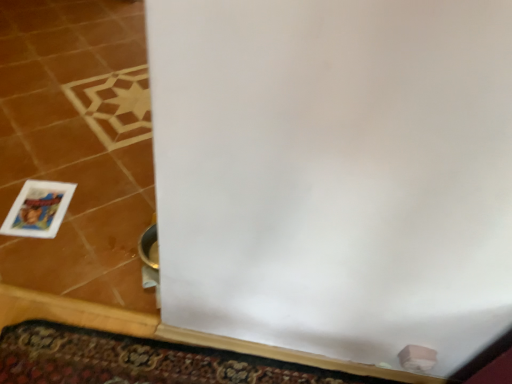
Question: Is carpeted doormat at lower center looking in the opposite direction of matte plastic picture frame at lower left?

Choices:
 (A) yes
 (B) no

Answer: (B)

Question: Considering the relative positions of carpeted doormat at lower center and matte plastic picture frame at lower left in the image provided, is carpeted doormat at lower center in front of matte plastic picture frame at lower left?

Choices:
 (A) yes
 (B) no

Answer: (A)

Question: Does carpeted doormat at lower center have a greater width compared to matte plastic picture frame at lower left?

Choices:
 (A) no
 (B) yes

Answer: (A)

Question: From the image's perspective, is carpeted doormat at lower center on top of matte plastic picture frame at lower left?

Choices:
 (A) yes
 (B) no

Answer: (B)

Question: Is carpeted doormat at lower center far away from matte plastic picture frame at lower left?

Choices:
 (A) yes
 (B) no

Answer: (B)

Question: From the image's perspective, is carpeted doormat at lower center below matte plastic picture frame at lower left?

Choices:
 (A) yes
 (B) no

Answer: (A)

Question: Is matte plastic picture frame at lower left shorter than carpeted doormat at lower center?

Choices:
 (A) no
 (B) yes

Answer: (A)

Question: From a real-world perspective, is matte plastic picture frame at lower left physically below carpeted doormat at lower center?

Choices:
 (A) yes
 (B) no

Answer: (A)

Question: From the image's perspective, would you say matte plastic picture frame at lower left is shown under carpeted doormat at lower center?

Choices:
 (A) no
 (B) yes

Answer: (A)

Question: From a real-world perspective, is matte plastic picture frame at lower left physically above carpeted doormat at lower center?

Choices:
 (A) yes
 (B) no

Answer: (B)

Question: Is matte plastic picture frame at lower left completely or partially outside of carpeted doormat at lower center?

Choices:
 (A) no
 (B) yes

Answer: (B)

Question: From the image's perspective, is matte plastic picture frame at lower left on top of carpeted doormat at lower center?

Choices:
 (A) no
 (B) yes

Answer: (B)

Question: From the image's perspective, is carpeted doormat at lower center above or below matte plastic picture frame at lower left?

Choices:
 (A) above
 (B) below

Answer: (B)